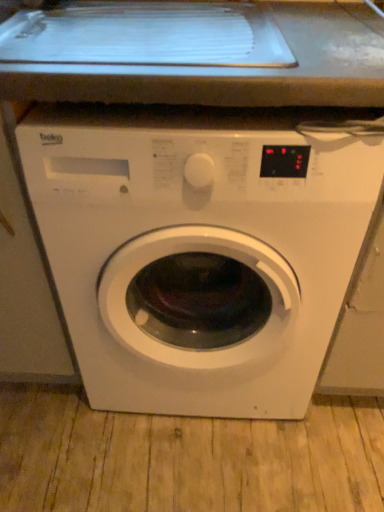
Image resolution: width=384 pixels, height=512 pixels. I want to click on white glossy washing machine at center, so (199, 249).

What do you see at coordinates (199, 249) in the screenshot? This screenshot has width=384, height=512. I see `white glossy washing machine at center` at bounding box center [199, 249].

You are a GUI agent. You are given a task and a screenshot of the screen. Output one action in this format:
    pyautogui.click(x=<x>, y=<y>)
    Task: Click on the white glossy washing machine at center
    
    Given the screenshot: What is the action you would take?
    pyautogui.click(x=199, y=249)